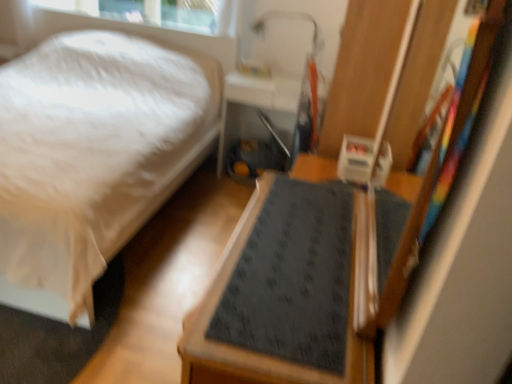
The image size is (512, 384). In order to click on vacant area on top of dark gray textured mat at center (from a real-world perspective) in this screenshot , I will do `click(301, 258)`.